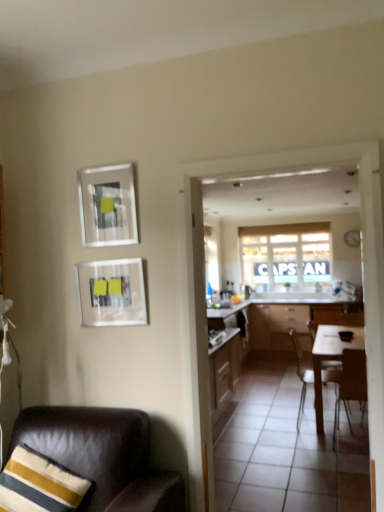
Question: In terms of width, does brown wooden chair at right, the second chair positioned from the back, look wider or thinner when compared to wooden cabinets at center?

Choices:
 (A) thin
 (B) wide

Answer: (A)

Question: In the image, is brown wooden chair at right, the second chair positioned from the back, on the left side or the right side of wooden cabinets at center?

Choices:
 (A) right
 (B) left

Answer: (B)

Question: Which of these objects is positioned farthest from the white glossy tile at center?

Choices:
 (A) striped fabric pillow at lower left
 (B) wooden chair at center, the 2th chair when ordered from right to left
 (C) brown wooden chair at right, the 2th chair positioned from the front
 (D) white fabric window at center
 (E) matte glass picture frame at upper left, marked as the second picture frame in a bottom-to-top arrangement

Answer: (D)

Question: Considering the real-world distances, which object is closest to the white glossy tile at center?

Choices:
 (A) wooden chair at center, the first chair positioned from the back
 (B) matte glass picture frame at center-left, the 2th picture frame in the top-to-bottom sequence
 (C) brown wooden chair at right, the 2th chair positioned from the front
 (D) leather chair at lower left, arranged as the third chair when viewed from the right
 (E) matte glass picture frame at upper left, acting as the first picture frame starting from the top

Answer: (C)